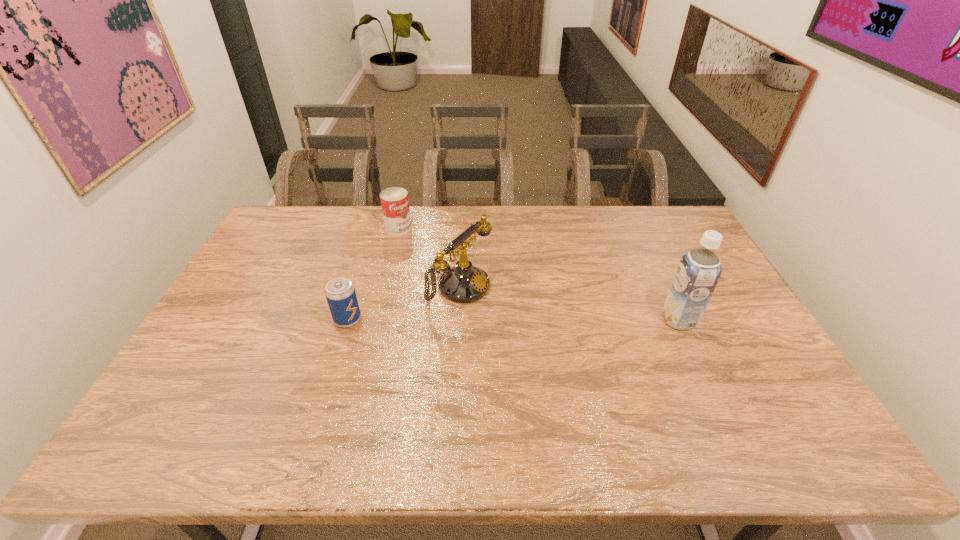
The image size is (960, 540). I want to click on free space that satisfies the following two spatial constraints: 1. on the front side of the tallest object; 2. on the label of the can, so click(x=376, y=320).